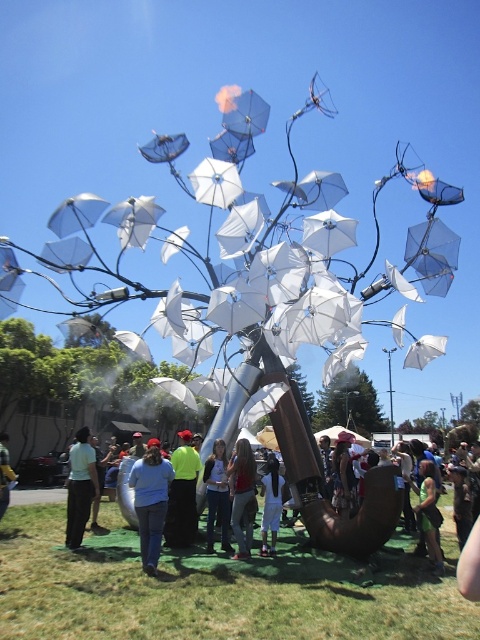
Question: Is light blue shirt at center further to camera compared to white matte umbrella at center?

Choices:
 (A) no
 (B) yes

Answer: (A)

Question: Which of the following is the closest to the observer?

Choices:
 (A) (142, 520)
 (B) (441, 524)
 (C) (0, 477)
 (D) (338, 458)

Answer: (A)

Question: Observing the image, what is the correct spatial positioning of blue cotton shirt at center in reference to white matte umbrella at center?

Choices:
 (A) left
 (B) right

Answer: (A)

Question: Considering the real-world distances, which object is closest to the blue cotton shirt at center?

Choices:
 (A) denim jeans at center
 (B) wooden hat at center

Answer: (A)

Question: Which object is positioned farthest from the light blue jeans at lower left?

Choices:
 (A) blue cotton shirt at center
 (B) metallic silver tree at center
 (C) denim jeans at center
 (D) neon yellow shirt at center

Answer: (B)

Question: Can you confirm if white matte umbrella at center is positioned to the left of light blue jeans at lower left?

Choices:
 (A) no
 (B) yes

Answer: (A)